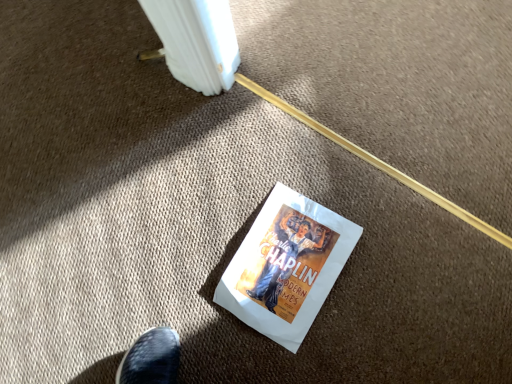
At what (x,y) coordinates should I click in order to perform the action: click on free space in front of white paper at center. Please return your answer as a coordinate pair (x, y). Looking at the image, I should click on (353, 341).